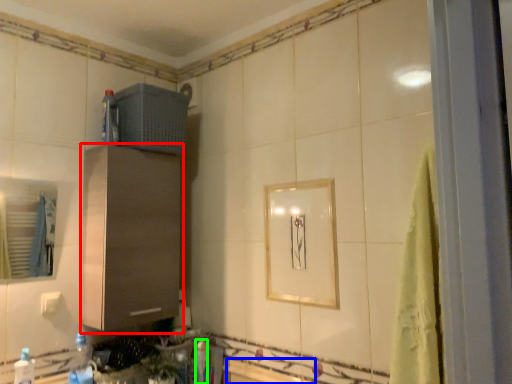
Question: Estimate the real-world distances between objects in this image. Which object is closer to cabinetry (highlighted by a red box), bath (highlighted by a blue box) or bottle (highlighted by a green box)?

Choices:
 (A) bath
 (B) bottle

Answer: (B)